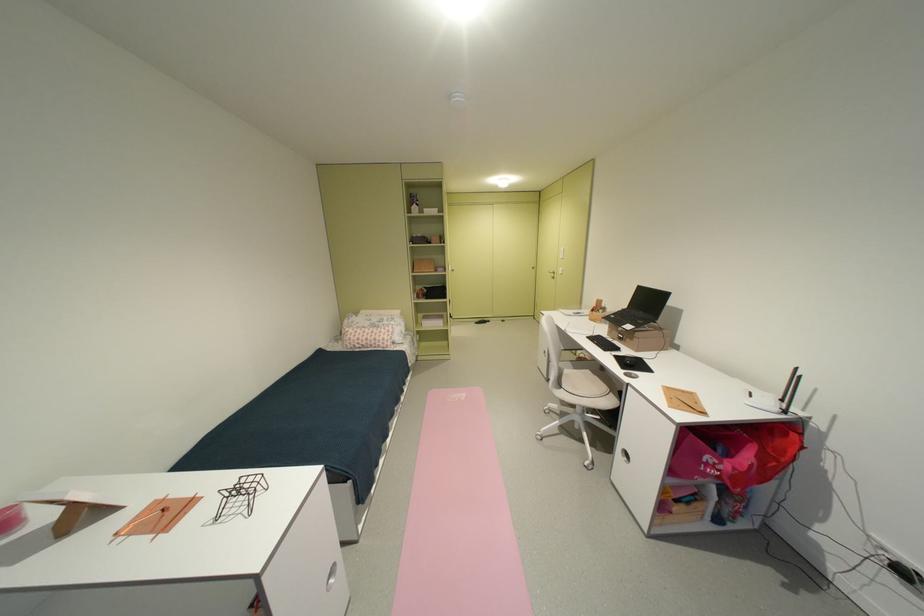
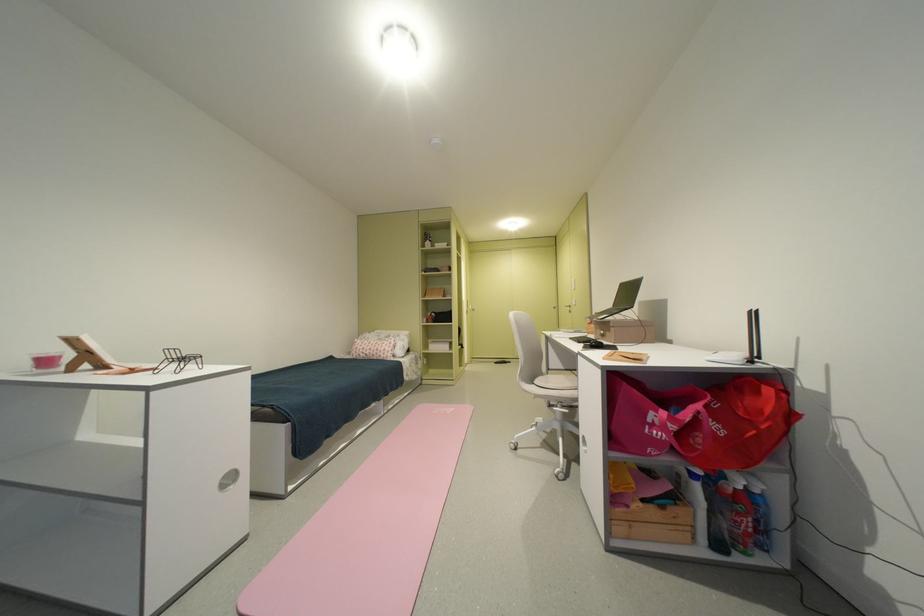
Find the pixel in the second image that matches [573,387] in the first image.

(543, 383)